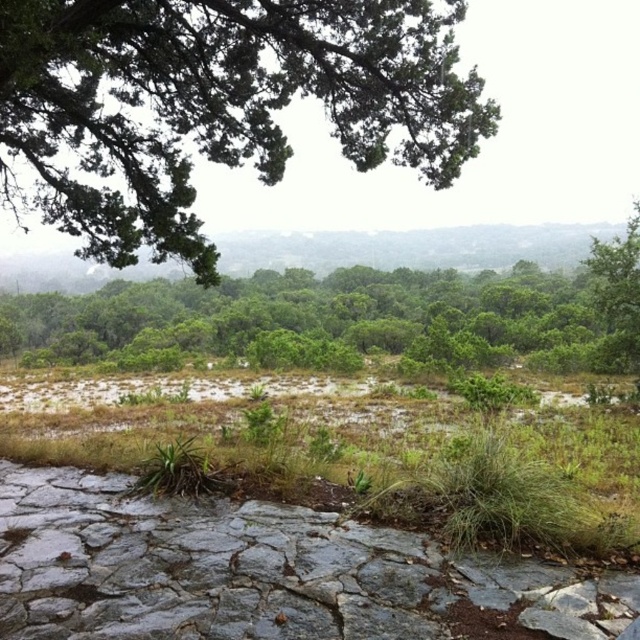
Question: Which of the following is the farthest from the observer?

Choices:
 (A) green leafy tree at center
 (B) green textured tree at upper left

Answer: (A)

Question: Estimate the real-world distances between objects in this image. Which object is closer to the green leafy tree at center?

Choices:
 (A) green grass at lower center
 (B) green textured tree at upper left

Answer: (A)

Question: Is green textured tree at upper left to the left of green grass at lower center from the viewer's perspective?

Choices:
 (A) no
 (B) yes

Answer: (B)

Question: Does green textured tree at upper left appear over green grass at lower center?

Choices:
 (A) no
 (B) yes

Answer: (B)

Question: Is green textured tree at upper left wider than green leafy tree at center?

Choices:
 (A) no
 (B) yes

Answer: (A)

Question: Which point is farther to the camera?

Choices:
 (A) (161, 195)
 (B) (529, 280)
 (C) (108, 378)

Answer: (B)